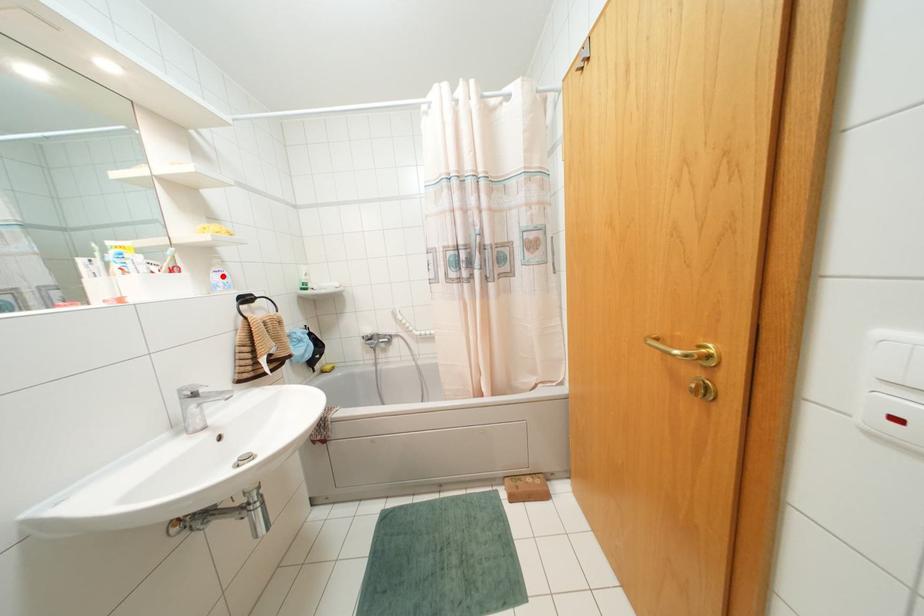
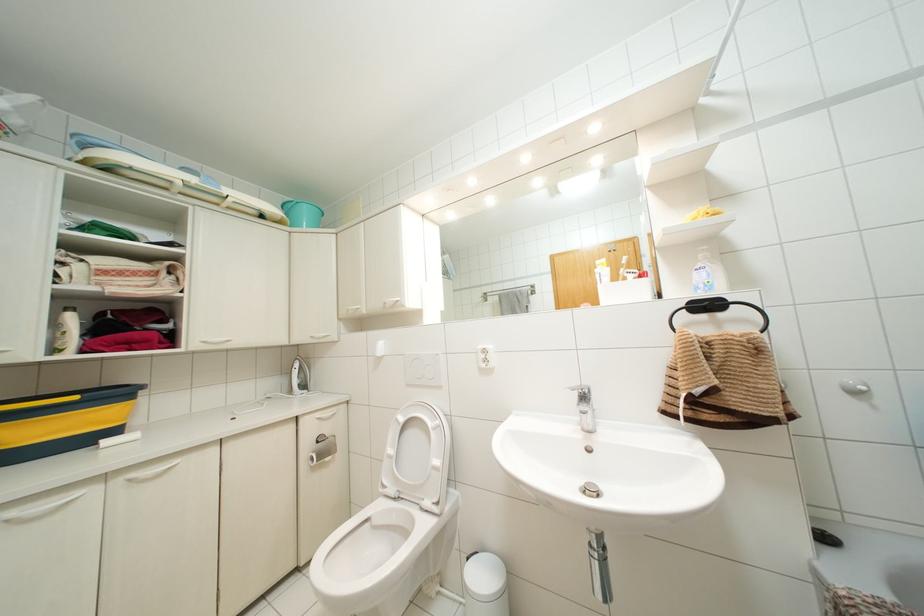
Question: I am providing you with two images of the same scene from different viewpoints. A red point is marked on the first image. Is the red point's position out of view in image 2?

Choices:
 (A) Yes
 (B) No

Answer: (B)